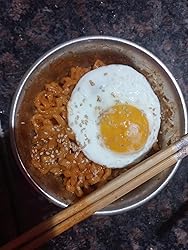
Where is `table`? table is located at coordinates (150, 235).